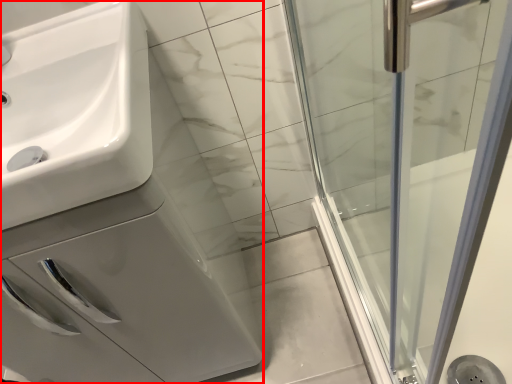
Question: Observing the image, what is the correct spatial positioning of porcelain (annotated by the red box) in reference to sink?

Choices:
 (A) left
 (B) right

Answer: (B)